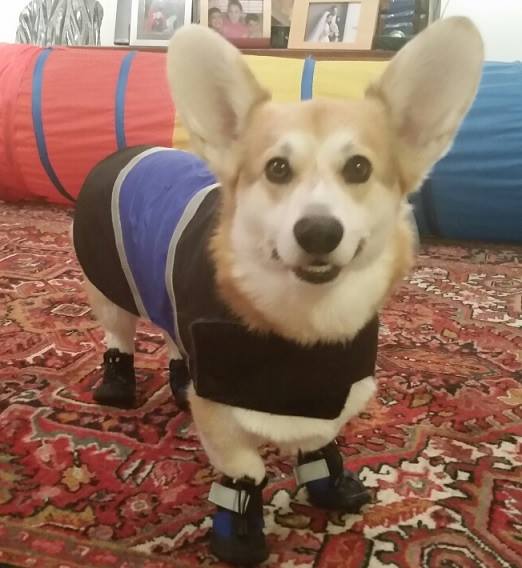
Where is `carpet`? Image resolution: width=522 pixels, height=568 pixels. carpet is located at coordinates click(167, 432).